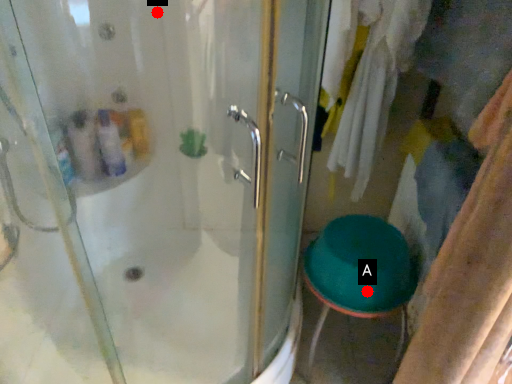
Question: Two points are circled on the image, labeled by A and B beside each circle. Which point is closer to the camera?

Choices:
 (A) A is closer
 (B) B is closer

Answer: (B)